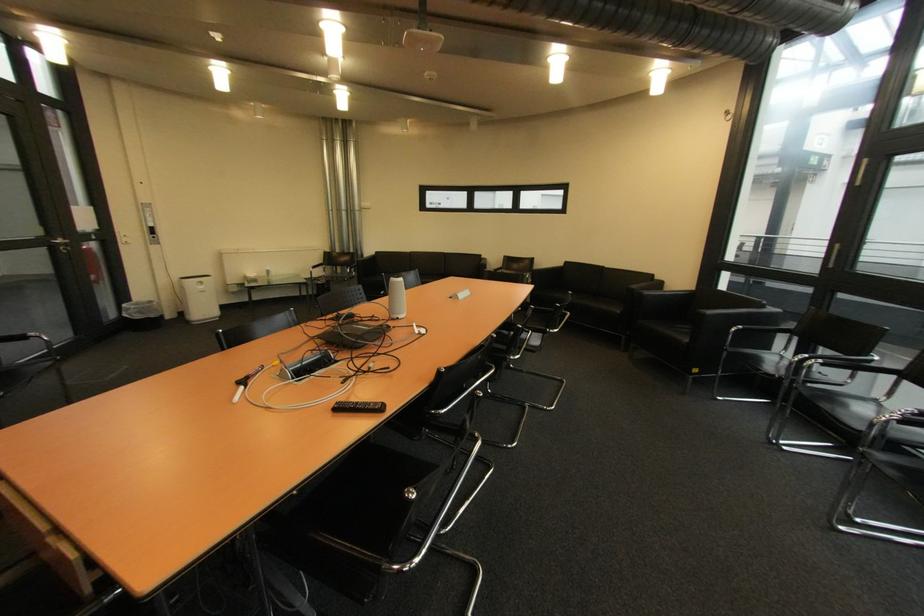
The height and width of the screenshot is (616, 924). Identify the location of grey conference speaker. (395, 297).